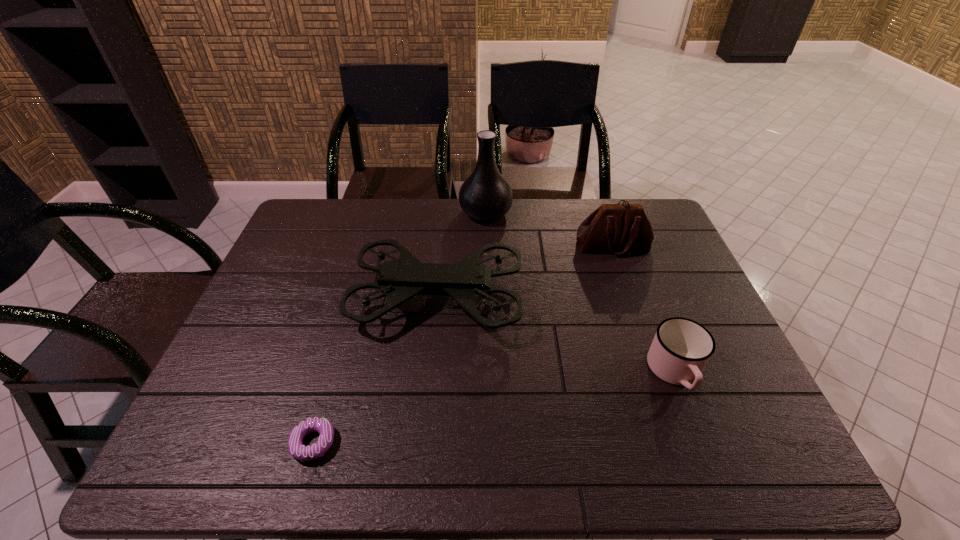
The width and height of the screenshot is (960, 540). I want to click on vacant area between the fourth shortest object and the doughnut, so click(375, 371).

Find the location of a particular element. free space between the shoulder bag and the tallest object is located at coordinates (549, 230).

Image resolution: width=960 pixels, height=540 pixels. I want to click on free space between the shortest object and the third shortest object, so click(463, 345).

Locate an element on the screen. The height and width of the screenshot is (540, 960). object that ranks as the second closest to the fourth nearest object is located at coordinates (485, 195).

Where is `object identified as the second closest to the shoulder bag`? object identified as the second closest to the shoulder bag is located at coordinates (485, 195).

The image size is (960, 540). In order to click on free space that satisfies the following two spatial constraints: 1. on the back side of the fourth nearest object; 2. on the left side of the drone in this screenshot , I will do `click(443, 246)`.